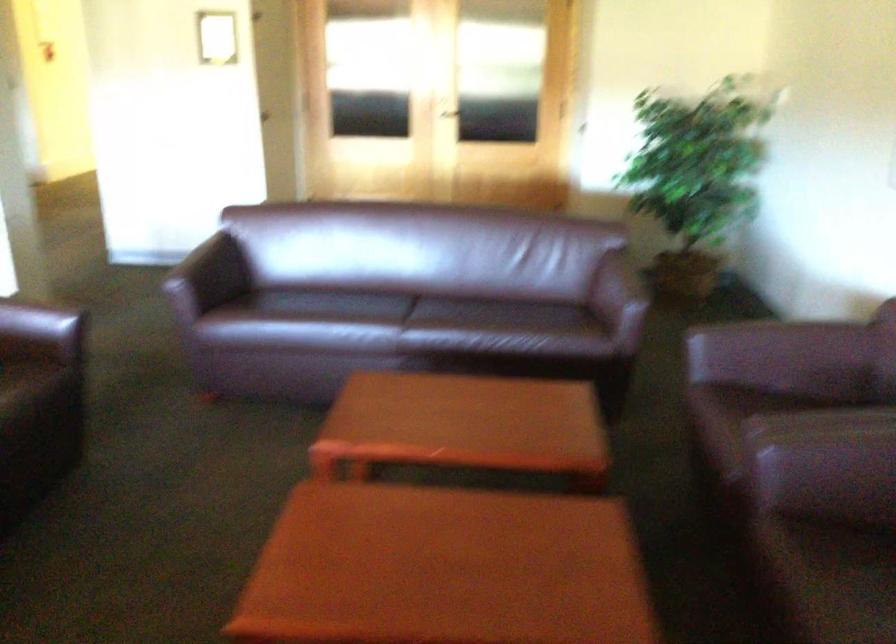
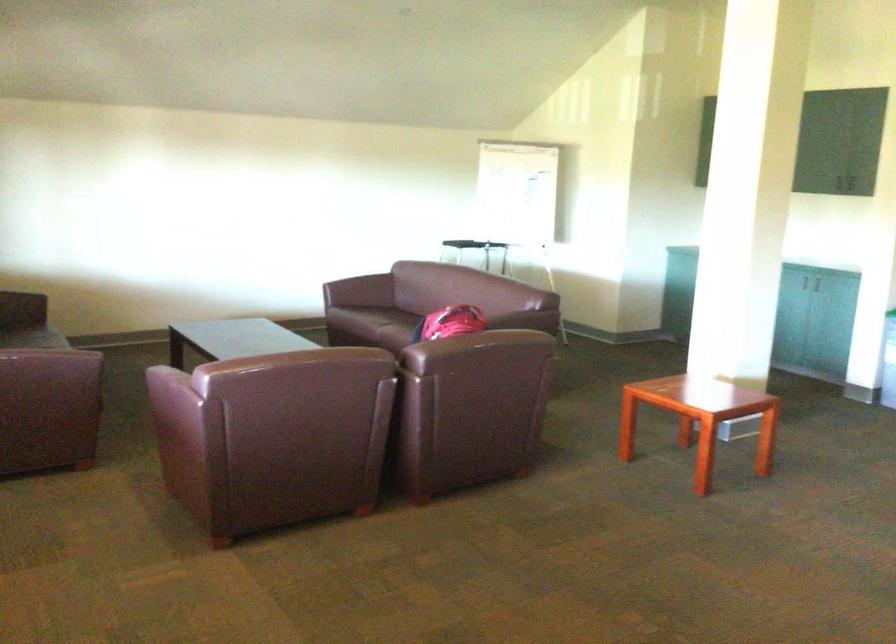
How did the camera likely rotate?

The camera rotated toward right-down.